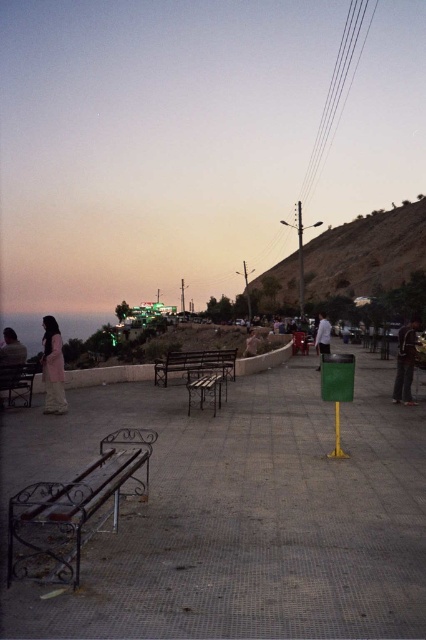
Question: Which point is closer to the camera?

Choices:
 (A) (22, 552)
 (B) (400, 385)

Answer: (A)

Question: Is pink fabric dress at left wider than light brown leather jacket at center?

Choices:
 (A) no
 (B) yes

Answer: (B)

Question: Does metallic bench at center have a lesser width compared to white fabric shirt at center?

Choices:
 (A) no
 (B) yes

Answer: (B)

Question: Based on their relative distances, which object is nearer to the metallic bench at center?

Choices:
 (A) metallic silver bench at center
 (B) light brown leather jacket at center
 (C) pink fabric dress at left

Answer: (A)

Question: Can you confirm if metallic bench at center is smaller than metallic silver bench at center?

Choices:
 (A) yes
 (B) no

Answer: (B)

Question: Which point is closer to the camera taking this photo?

Choices:
 (A) (2, 388)
 (B) (247, 336)
 (C) (313, 276)
 (D) (402, 385)

Answer: (A)